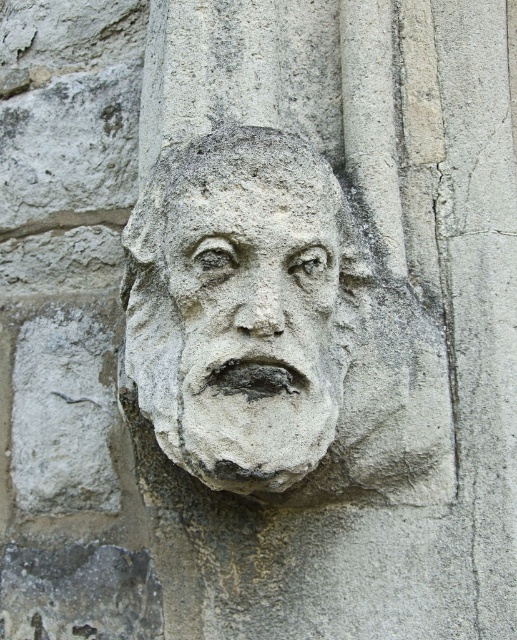
Question: Which object is closer to the camera taking this photo?

Choices:
 (A) stone textured face at center
 (B) stone face at center

Answer: (B)

Question: Does stone face at center come in front of stone textured face at center?

Choices:
 (A) yes
 (B) no

Answer: (A)

Question: Among these points, which one is nearest to the camera?

Choices:
 (A) (313, 262)
 (B) (236, 289)

Answer: (B)

Question: Does stone face at center have a greater width compared to stone textured face at center?

Choices:
 (A) yes
 (B) no

Answer: (A)

Question: Is stone face at center wider than stone textured face at center?

Choices:
 (A) no
 (B) yes

Answer: (B)